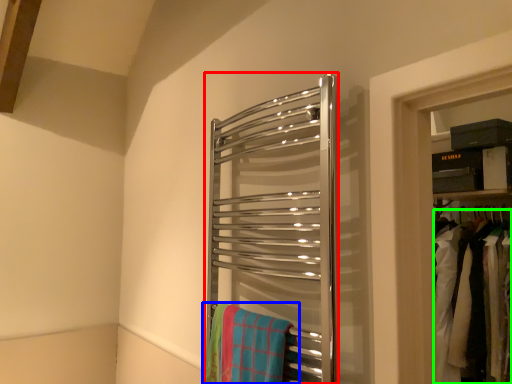
Question: Which is farther away from towel rack (highlighted by a red box)? beach towel (highlighted by a blue box) or laundry (highlighted by a green box)?

Choices:
 (A) beach towel
 (B) laundry

Answer: (B)